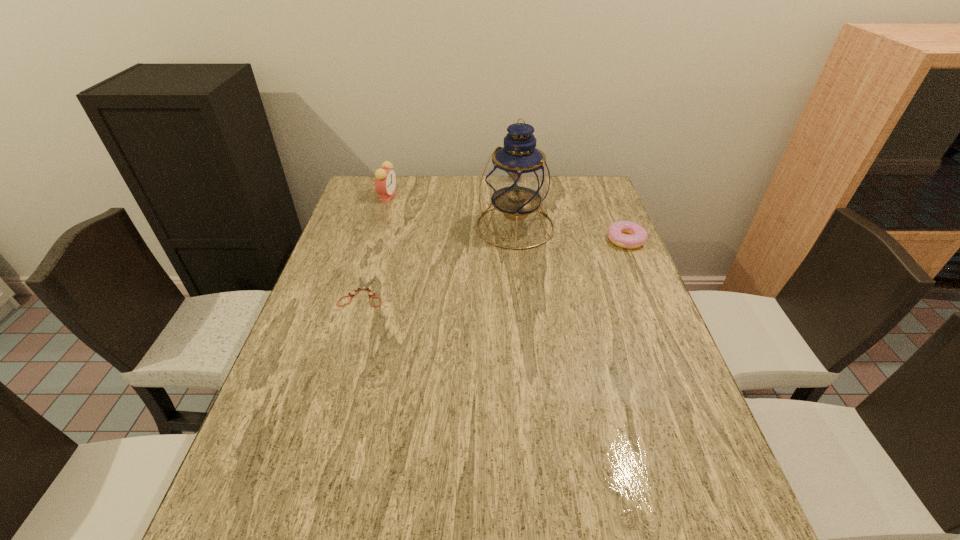
Identify the location of the nearest object. The height and width of the screenshot is (540, 960). click(363, 287).

Where is `the shortest object`? the shortest object is located at coordinates (363, 287).

Locate an element on the screen. This screenshot has width=960, height=540. the rightmost object is located at coordinates (617, 232).

This screenshot has height=540, width=960. Find the location of `doughnut`. doughnut is located at coordinates 617,232.

Identify the location of lantern. The image size is (960, 540). (518, 178).

This screenshot has height=540, width=960. What are the coordinates of `the third object from left to right` in the screenshot? It's located at (518, 178).

The height and width of the screenshot is (540, 960). I want to click on alarm clock, so click(385, 178).

I want to click on the farthest object, so pos(385,178).

You are a GUI agent. You are given a task and a screenshot of the screen. Output one action in this format:
    pyautogui.click(x=<x>, y=<y>)
    Task: Click on the vacant region located on the right of the shortest object
    This screenshot has height=540, width=960.
    Given the screenshot: What is the action you would take?
    pyautogui.click(x=533, y=292)

This screenshot has width=960, height=540. What are the coordinates of `vacant space located 0.290m on the front of the rightmost object` in the screenshot? It's located at (660, 322).